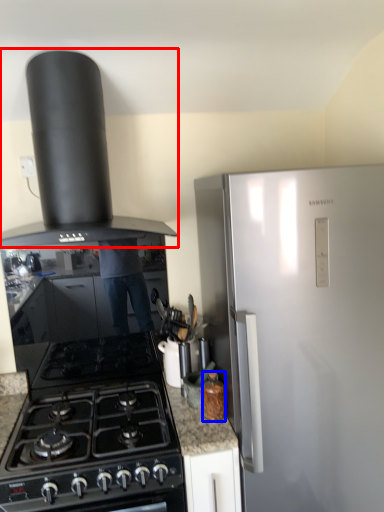
Question: Which object appears closest to the camera in this image, kitchen appliance (highlighted by a red box) or kitchen appliance (highlighted by a blue box)?

Choices:
 (A) kitchen appliance
 (B) kitchen appliance

Answer: (A)